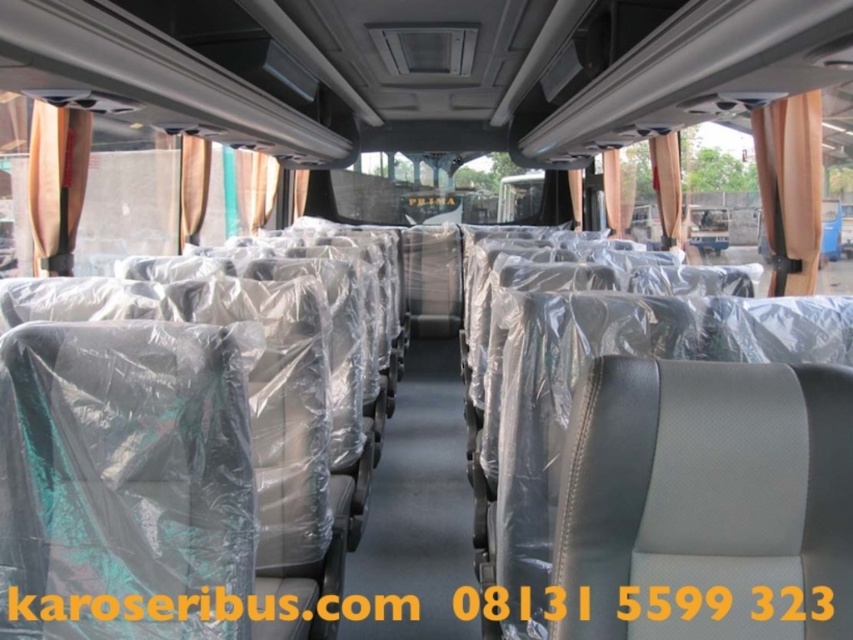
Measure the distance between orange fabric curtain at upper right and metallic gold curtain at left.

3.73 meters

Who is shorter, orange fabric curtain at upper right or metallic gold curtain at left?

metallic gold curtain at left is shorter.

Who is more forward, (772, 243) or (50, 228)?

Point (50, 228) is more forward.

The width and height of the screenshot is (853, 640). I want to click on orange fabric curtain at upper right, so click(x=790, y=188).